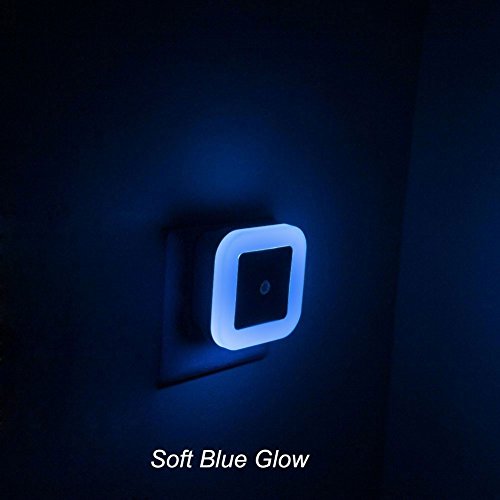
At what (x,y) coordinates should I click in order to perform the action: click on blue walls. Please return your answer as a coordinate pair (x, y). Looking at the image, I should click on (115, 308), (418, 366).